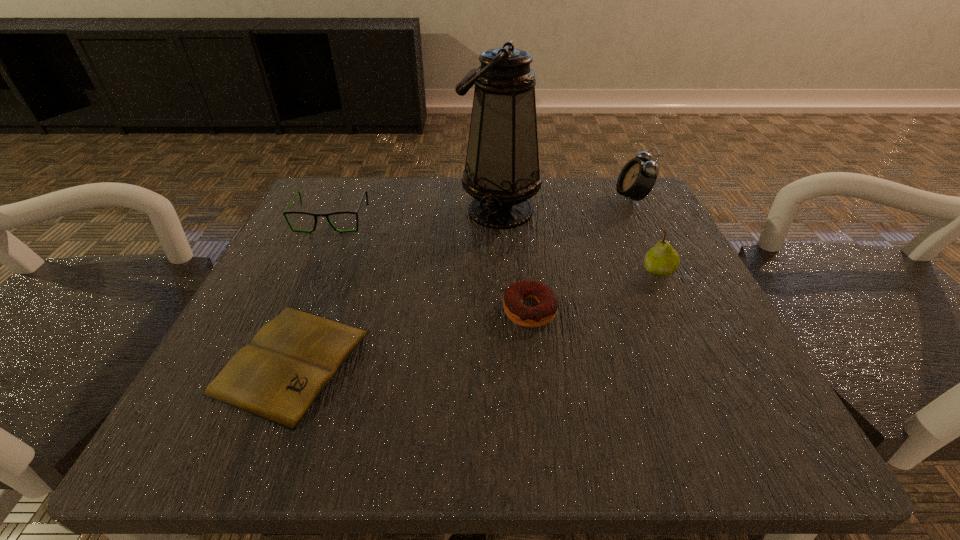
The image size is (960, 540). Identify the location of book at the left edge. (278, 376).

The width and height of the screenshot is (960, 540). I want to click on alarm clock that is positioned at the right edge, so click(x=637, y=178).

This screenshot has height=540, width=960. In order to click on pear situated at the right edge in this screenshot , I will do `click(662, 260)`.

Identify the location of object that is positioned at the far left corner. (285, 212).

Locate an element on the screen. The image size is (960, 540). object located at the near left corner is located at coordinates (278, 376).

Locate an element on the screen. Image resolution: width=960 pixels, height=540 pixels. object that is at the far right corner is located at coordinates (637, 178).

Find the location of a particular element. This screenshot has width=960, height=540. vacant region at the far edge is located at coordinates (x=469, y=204).

Find the location of a particular element. This screenshot has height=540, width=960. free space at the near edge of the desktop is located at coordinates (552, 399).

I want to click on free location at the left edge, so click(356, 260).

You are a GUI agent. You are given a task and a screenshot of the screen. Output one action in this format:
    pyautogui.click(x=<x>, y=<y>)
    Task: Click on the vacant space at the right edge of the desktop
    The width and height of the screenshot is (960, 540).
    Given the screenshot: What is the action you would take?
    pyautogui.click(x=683, y=318)